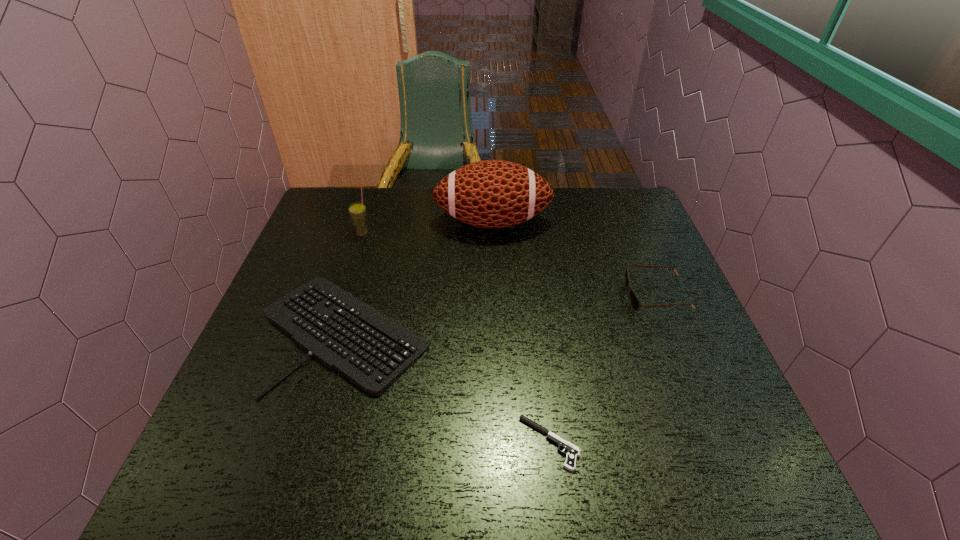
Where is `object that is the third closest to the shortest object`? The width and height of the screenshot is (960, 540). object that is the third closest to the shortest object is located at coordinates (491, 193).

The width and height of the screenshot is (960, 540). In order to click on blank area in the image that satisfies the following two spatial constraints: 1. on the back side of the second shortest object; 2. on the left side of the football in this screenshot , I will do `click(376, 222)`.

Find the location of `blank area in the image that satisfies the following two spatial constraints: 1. on the back side of the football; 2. on the left side of the fourth tallest object`. blank area in the image that satisfies the following two spatial constraints: 1. on the back side of the football; 2. on the left side of the fourth tallest object is located at coordinates (376, 222).